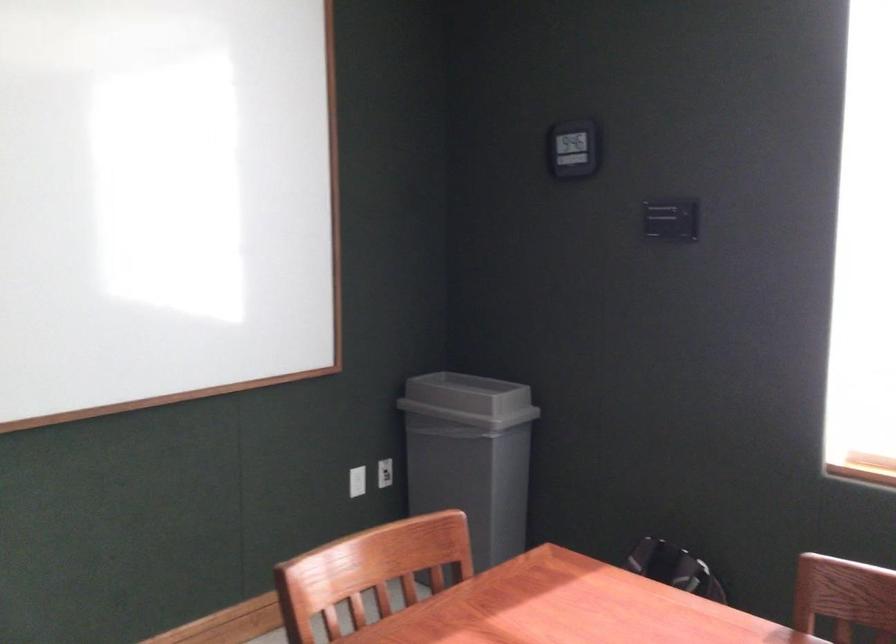
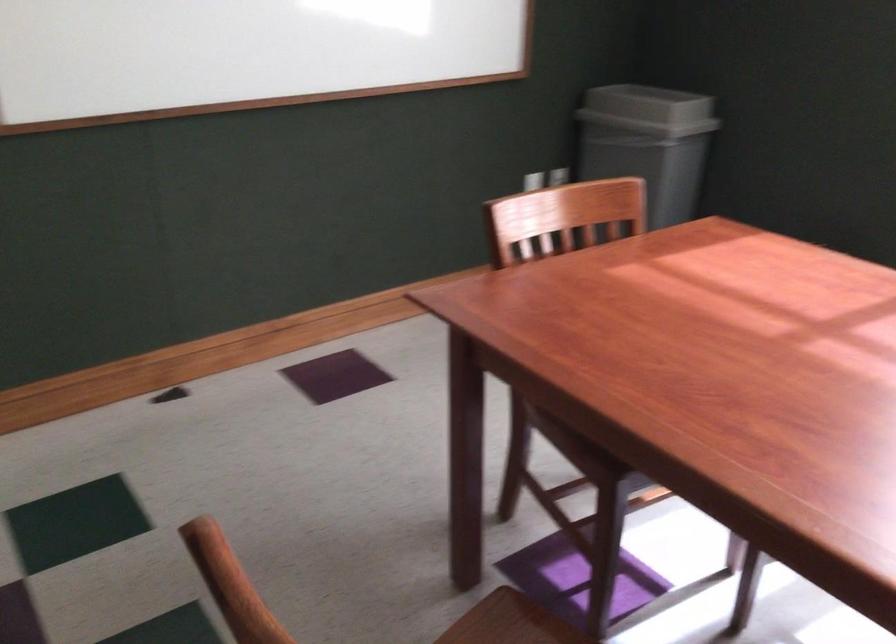
Question: How did the camera likely rotate?

Choices:
 (A) Left
 (B) Right
 (C) Up
 (D) Down

Answer: (D)